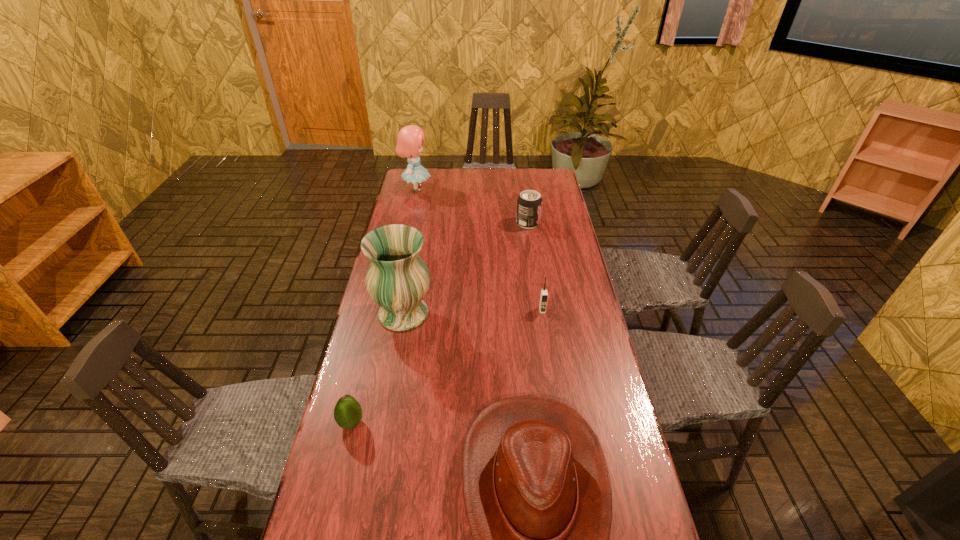
In order to click on doll in this screenshot , I will do 409,142.

Identify the location of vase. 397,279.

The height and width of the screenshot is (540, 960). Find the location of `cellular telephone`. cellular telephone is located at coordinates (544, 294).

Locate an element on the screen. This screenshot has height=540, width=960. the second farthest object is located at coordinates (529, 204).

Where is `avocado`? This screenshot has height=540, width=960. avocado is located at coordinates (347, 413).

Find the location of a particular element. The height and width of the screenshot is (540, 960). vacant area situated 0.200m on the front-facing side of the doll is located at coordinates (475, 188).

Where is `free region located on the right of the vase`? The height and width of the screenshot is (540, 960). free region located on the right of the vase is located at coordinates pos(482,314).

The width and height of the screenshot is (960, 540). I want to click on free space located 0.310m on the front-facing side of the cellular telephone, so click(x=555, y=394).

Locate an element on the screen. Image resolution: width=960 pixels, height=540 pixels. vacant space positioned on the back of the fifth nearest object is located at coordinates (526, 210).

The width and height of the screenshot is (960, 540). Find the location of `vacant space located 0.170m on the back of the avocado`. vacant space located 0.170m on the back of the avocado is located at coordinates (367, 360).